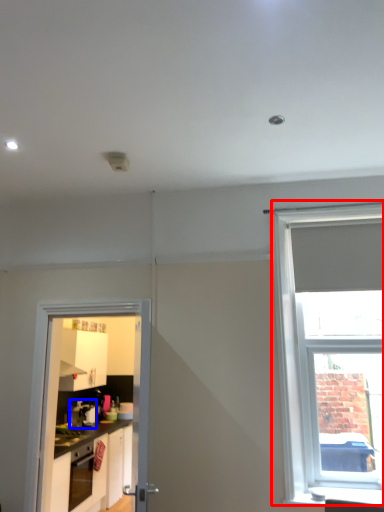
Question: Which point is further to the camera, window (highlighted by a red box) or coffee machine (highlighted by a blue box)?

Choices:
 (A) window
 (B) coffee machine

Answer: (B)